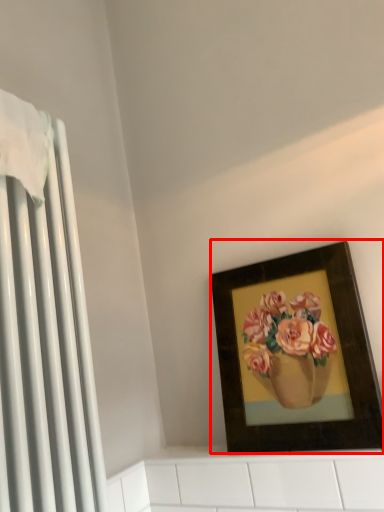
Question: Observing the image, what is the correct spatial positioning of picture frame (annotated by the red box) in reference to radiator?

Choices:
 (A) left
 (B) right

Answer: (B)